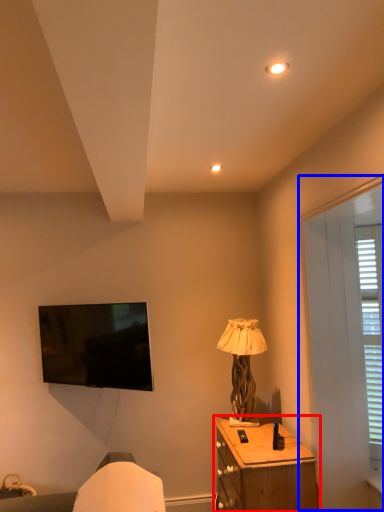
Question: Which of the following is the farthest to the observer, nightstand (highlighted by a red box) or screen door (highlighted by a blue box)?

Choices:
 (A) nightstand
 (B) screen door

Answer: (A)